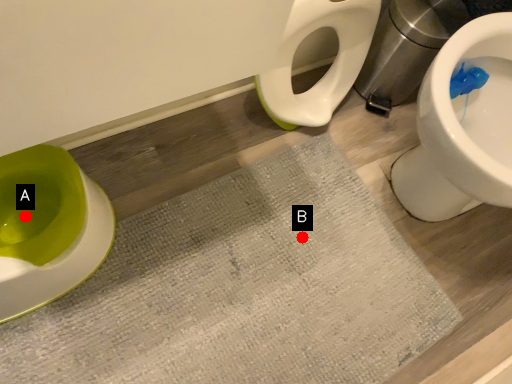
Question: Two points are circled on the image, labeled by A and B beside each circle. Which of the following is the farthest from the observer?

Choices:
 (A) A is further
 (B) B is further

Answer: (B)